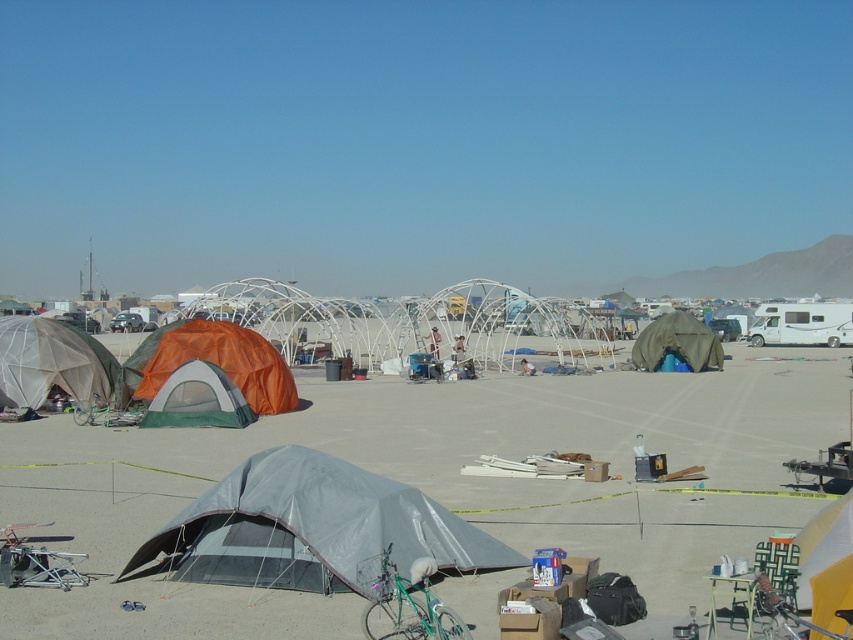
You are standing at the point marked as point (314, 528) in the desert scene. Which object are you standing on?

You are standing on the gray tarp tent at lower center because the point (314, 528) is located on it.

You are standing in the desert and see two points marked on the ground. The first point is at coordinates point [57,376] and the second point is at coordinates point [703,340]. Which point is closer to you?

Point [57,376] is closer to the viewer than point [703,340].

Based on the photo, you are planning to set up a satellite dish that requires a clear line of sight to the sky. Considering the matte gray tent at left and the orange mesh tent at lower left, which tent would provide a better vantage point for the satellite dish?

The matte gray tent at left has a greater height compared to the orange mesh tent at lower left, so it would provide a better vantage point for the satellite dish due to its taller structure.